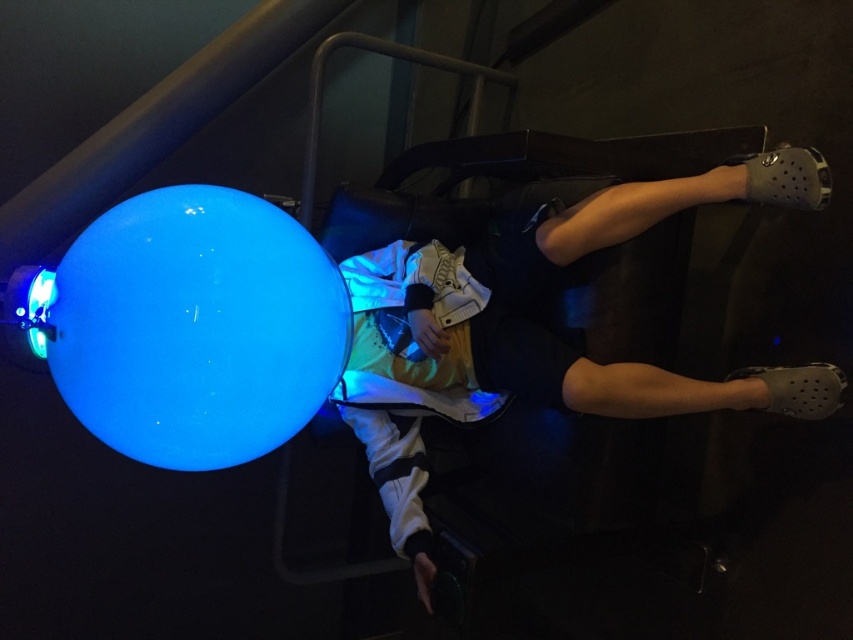
You are a photographer standing at a certain distance from the white fabric pants at center. You need to capture a closeup shot of the pants. Given that your camera can focus on objects within 5 feet, will you be able to take the closeup without moving closer?

The distance of white fabric pants at center from camera is 4.72 feet, which is within the camera focus range of 5 feet. Therefore, you can take the closeup without moving closer.

You are a technician in a lab. You need to place a 24 inch long tool between the white fabric pants at center and the glossy blue sphere at center. Is there enough space?

The distance between the white fabric pants at center and the glossy blue sphere at center is 24.16 inches, so yes, there is enough space to place the 24 inch long tool between them.